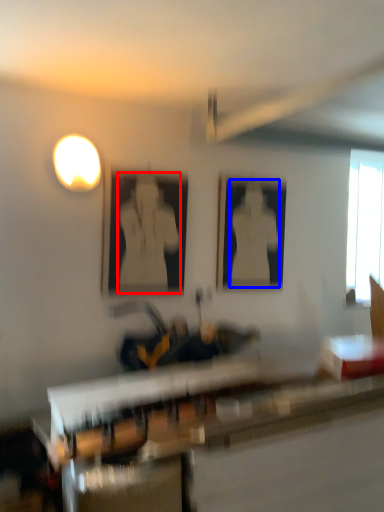
Question: Which point is closer to the camera, person (highlighted by a red box) or person (highlighted by a blue box)?

Choices:
 (A) person
 (B) person

Answer: (A)